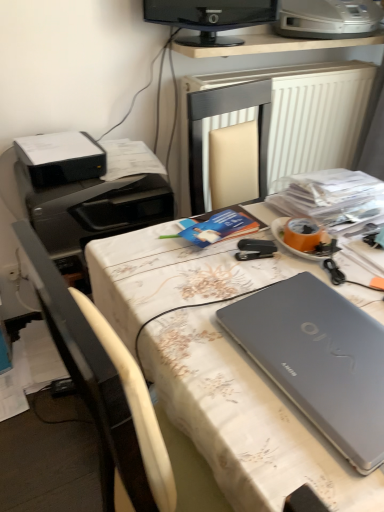
Question: Should I look upward or downward to see white textured radiator at upper center?

Choices:
 (A) down
 (B) up

Answer: (B)

Question: Considering the relative sizes of white fabric-covered desk at center and black plastic printer at left, the 2th printer when ordered from left to right, in the image provided, is white fabric-covered desk at center wider than black plastic printer at left, the 2th printer when ordered from left to right,?

Choices:
 (A) yes
 (B) no

Answer: (A)

Question: Is white fabric-covered desk at center in front of black plastic printer at left, the third printer when ordered from top to bottom?

Choices:
 (A) yes
 (B) no

Answer: (A)

Question: Can black plastic printer at left, the 2th printer when ordered from left to right, be found inside white fabric-covered desk at center?

Choices:
 (A) no
 (B) yes

Answer: (A)

Question: Considering the relative sizes of white fabric-covered desk at center and black plastic printer at left, the third printer when ordered from top to bottom, in the image provided, is white fabric-covered desk at center shorter than black plastic printer at left, the third printer when ordered from top to bottom,?

Choices:
 (A) no
 (B) yes

Answer: (A)

Question: Is white fabric-covered desk at center at the left side of black plastic printer at left, the 1th printer ordered from the bottom?

Choices:
 (A) no
 (B) yes

Answer: (A)

Question: Is white fabric-covered desk at center thinner than black plastic printer at left, the 1th printer ordered from the bottom?

Choices:
 (A) no
 (B) yes

Answer: (A)

Question: From the image's perspective, would you say silver metallic printer at upper right, acting as the third printer starting from the left, is positioned over black plastic printer at left, the third printer when ordered from top to bottom?

Choices:
 (A) yes
 (B) no

Answer: (A)

Question: Is silver metallic printer at upper right, acting as the third printer starting from the left, smaller than black plastic printer at left, the 2th printer when ordered from left to right?

Choices:
 (A) yes
 (B) no

Answer: (A)

Question: Is black plastic printer at left, the 1th printer ordered from the bottom, located within silver metallic printer at upper right, which appears as the 3th printer when ordered from the bottom?

Choices:
 (A) yes
 (B) no

Answer: (B)

Question: Can you confirm if silver metallic printer at upper right, which appears as the 3th printer when ordered from the bottom, is bigger than black plastic printer at left, which is the second printer from right to left?

Choices:
 (A) no
 (B) yes

Answer: (A)

Question: Does silver metallic printer at upper right, which is counted as the 1th printer, starting from the right, have a greater width compared to black plastic printer at left, the 2th printer when ordered from left to right?

Choices:
 (A) no
 (B) yes

Answer: (A)

Question: Is silver metallic printer at upper right, which appears as the 3th printer when ordered from the bottom, further to camera compared to black plastic printer at left, the 2th printer when ordered from left to right?

Choices:
 (A) yes
 (B) no

Answer: (A)

Question: Would you consider black plastic printer at upper left, arranged as the 2th printer when ordered from the bottom, to be distant from white textured radiator at upper center?

Choices:
 (A) yes
 (B) no

Answer: (B)